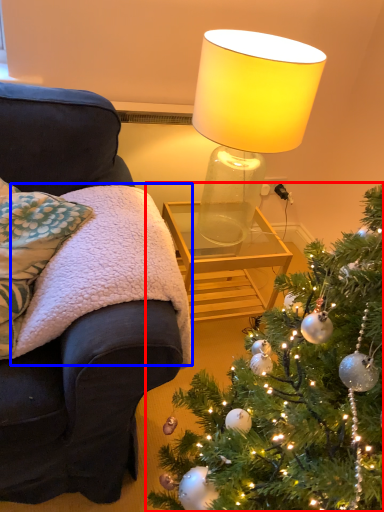
Question: Among these objects, which one is nearest to the camera, christmas tree (highlighted by a red box) or blanket (highlighted by a blue box)?

Choices:
 (A) christmas tree
 (B) blanket

Answer: (A)